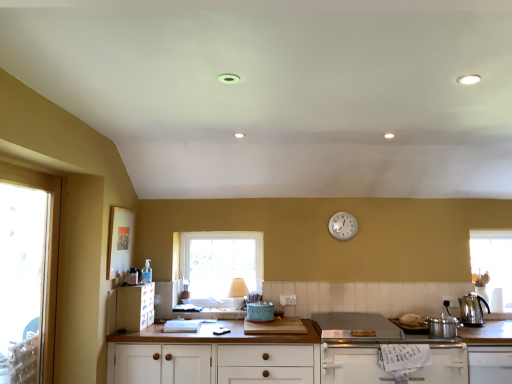
Where is `vacant area that lies in front of stainless steel kettle at right`? The height and width of the screenshot is (384, 512). vacant area that lies in front of stainless steel kettle at right is located at coordinates (482, 324).